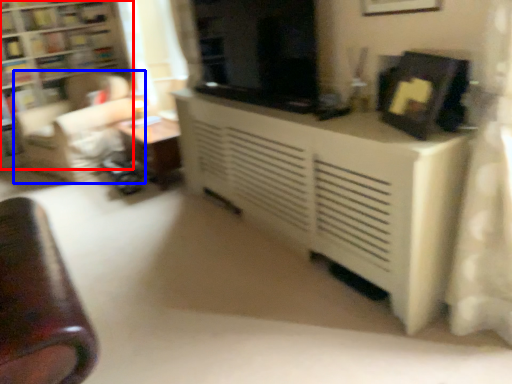
Question: Which object appears farthest to the camera in this image, bookcase (highlighted by a red box) or swivel chair (highlighted by a blue box)?

Choices:
 (A) bookcase
 (B) swivel chair

Answer: (A)